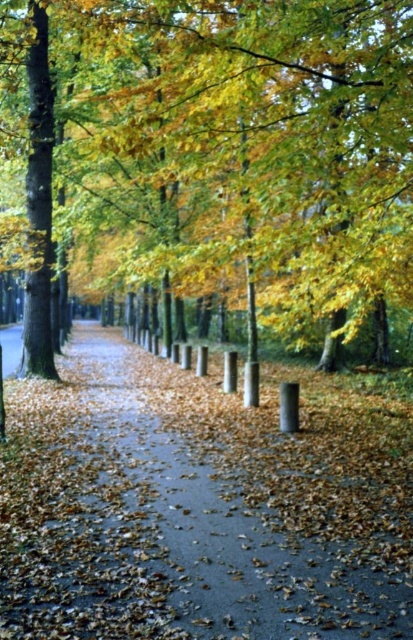
Question: Which point is farther to the camera?

Choices:
 (A) smooth asphalt pavement at center
 (B) golden leafy tree at center

Answer: (B)

Question: Is golden leafy tree at center positioned before smooth asphalt pavement at center?

Choices:
 (A) yes
 (B) no

Answer: (B)

Question: In this image, where is golden leafy tree at center located relative to smooth asphalt pavement at center?

Choices:
 (A) below
 (B) above

Answer: (B)

Question: Among these objects, which one is farthest from the camera?

Choices:
 (A) smooth asphalt pavement at center
 (B) golden leafy tree at center

Answer: (B)

Question: Considering the relative positions of golden leafy tree at center and smooth asphalt pavement at center in the image provided, where is golden leafy tree at center located with respect to smooth asphalt pavement at center?

Choices:
 (A) right
 (B) left

Answer: (B)

Question: Among these points, which one is nearest to the camera?

Choices:
 (A) (322, 4)
 (B) (71, 552)

Answer: (B)